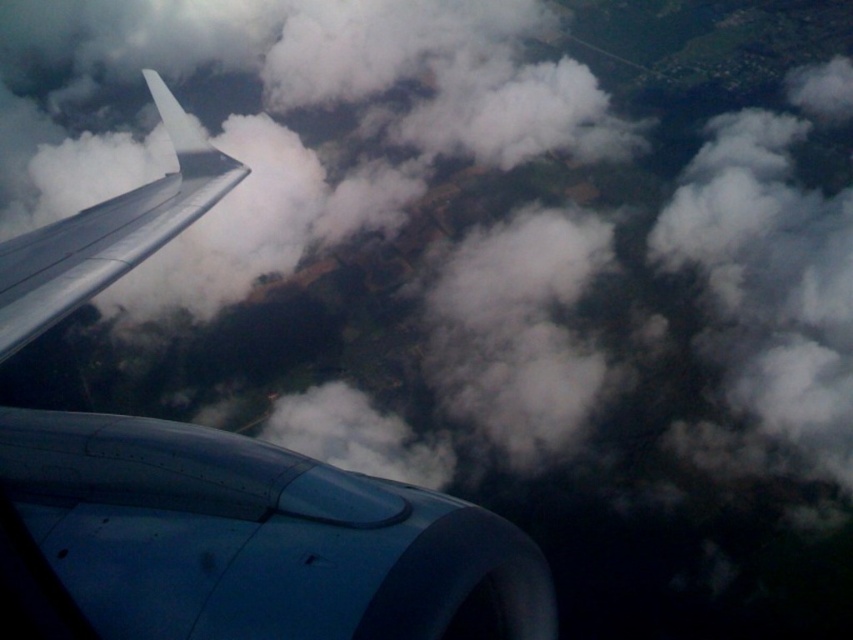
You are a pilot checking the engine position relative to the wing. According to the image, where is the metallic blue engine at lower left located in relation to the wing?

The metallic blue engine at lower left is positioned below the wing, as its coordinates at point (247, 540) place it in the lower section of the frame where the wing extends diagonally across the left side.

From the picture: You are a flight attendant checking the aircraft components from the window. You notice the metallic blue engine at lower left and the metallic gray wing at upper left. Which component has a smaller width?

The metallic blue engine at lower left has a smaller width than the metallic gray wing at upper left.

You are a passenger sitting by the window and notice two metallic objects outside. The first is the metallic blue engine at lower left and the second is the metallic gray wing at upper left. Which of these two objects is positioned more to the right from your perspective?

The metallic blue engine at lower left is positioned to the right of the metallic gray wing at upper left, so the engine is more to the right.